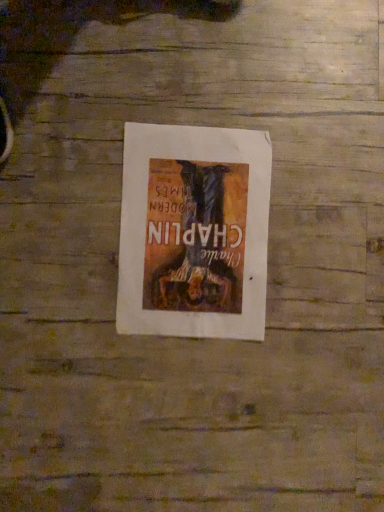
At what (x,y) coordinates should I click in order to perform the action: click on vacant region above matte paper poster at center (from a real-world perspective). Please return your answer as a coordinate pair (x, y). Looking at the image, I should click on (197, 229).